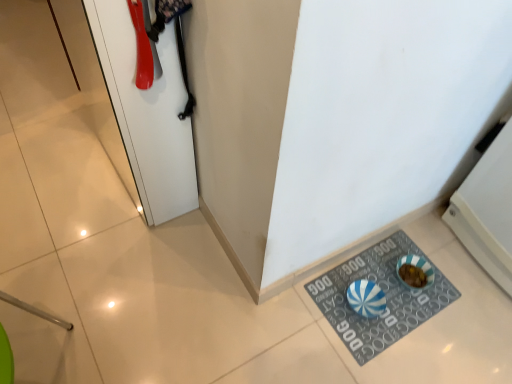
Locate an element on the screen. Image resolution: width=512 pixels, height=384 pixels. vacant space that is to the left of blue and white striped rubber mat at lower right is located at coordinates (279, 335).